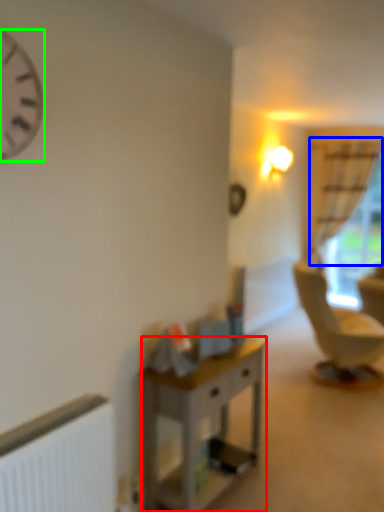
Question: Which object is positioned closest to desk (highlighted by a red box)? Select from curtain (highlighted by a blue box) and clock (highlighted by a green box).

Choices:
 (A) curtain
 (B) clock

Answer: (B)